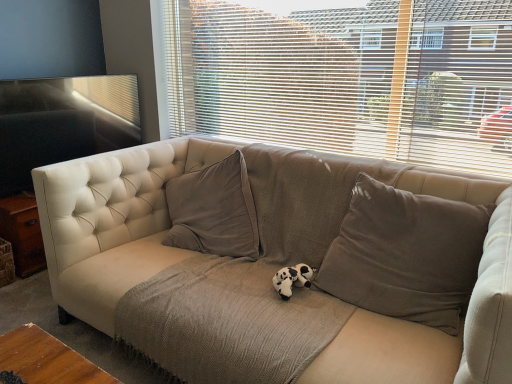
Question: In terms of width, does black plush toy at center look wider or thinner when compared to beige fabric couch at center?

Choices:
 (A) wide
 (B) thin

Answer: (B)

Question: Is black plush toy at center taller or shorter than beige fabric couch at center?

Choices:
 (A) tall
 (B) short

Answer: (B)

Question: Estimate the real-world distances between objects in this image. Which object is closer to the beige fabric blinds at upper center?

Choices:
 (A) beige fabric couch at center
 (B) matte wood table at left
 (C) brown fabric pillow at center
 (D) black plush toy at center

Answer: (C)

Question: Based on their relative distances, which object is farther from the matte wood table at left?

Choices:
 (A) beige fabric blinds at upper center
 (B) beige fabric couch at center
 (C) black plush toy at center
 (D) brown fabric pillow at center

Answer: (D)